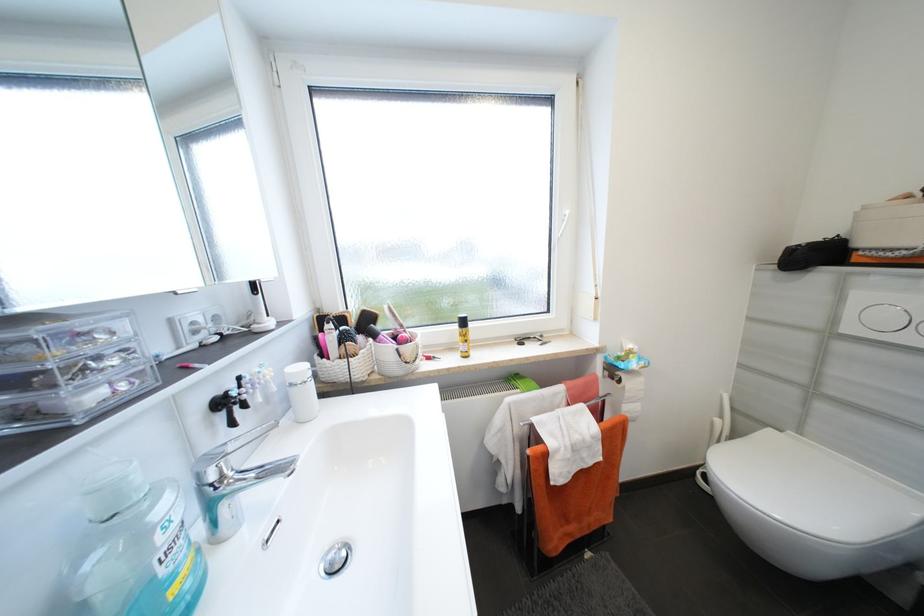
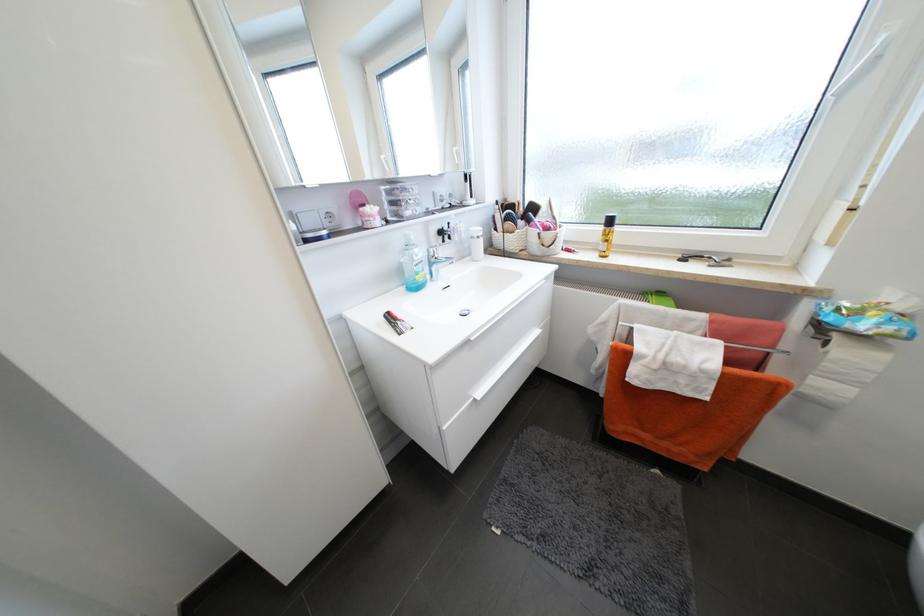
The point at (298, 386) is marked in the first image. Where is the corresponding point in the second image?

(478, 238)